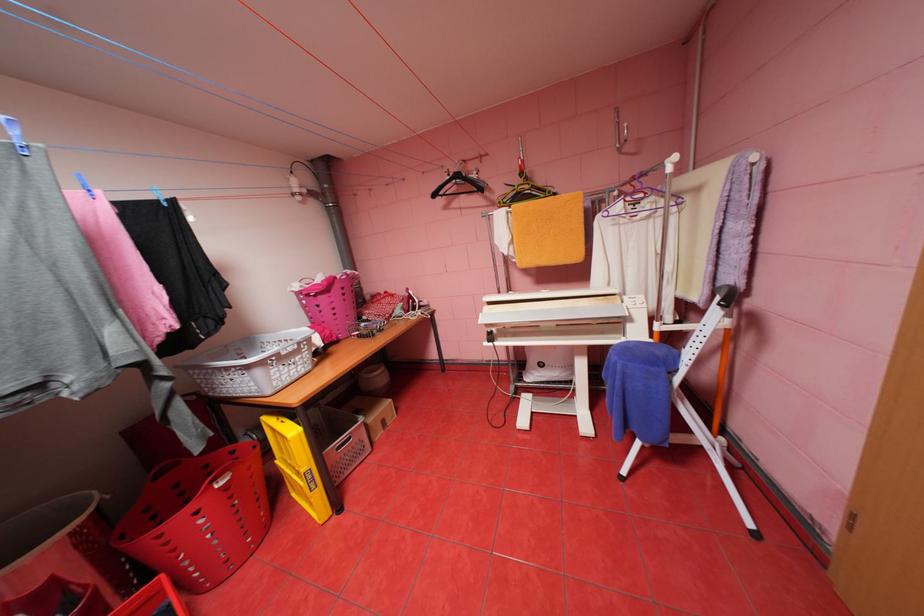
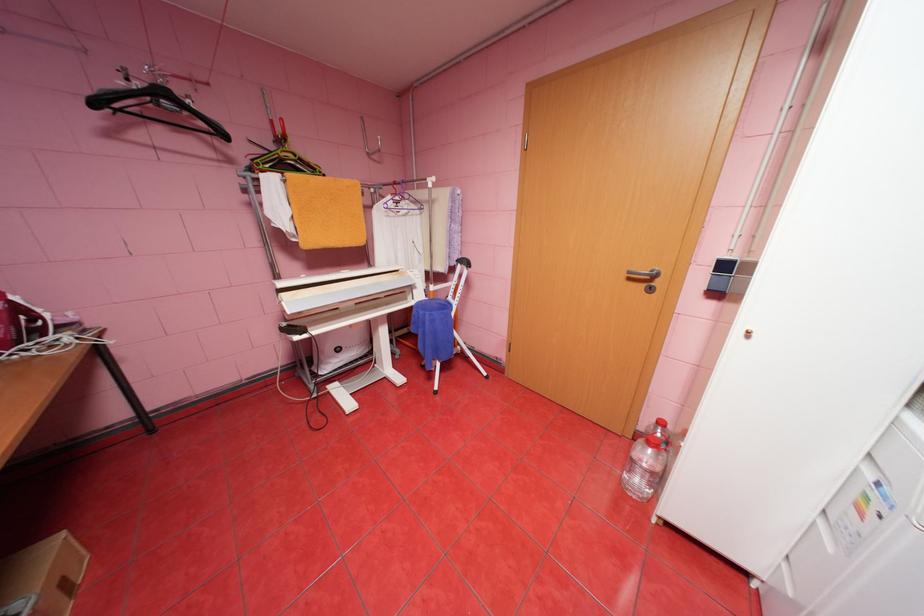
The point at (443, 195) is marked in the first image. Where is the corresponding point in the second image?

(103, 103)